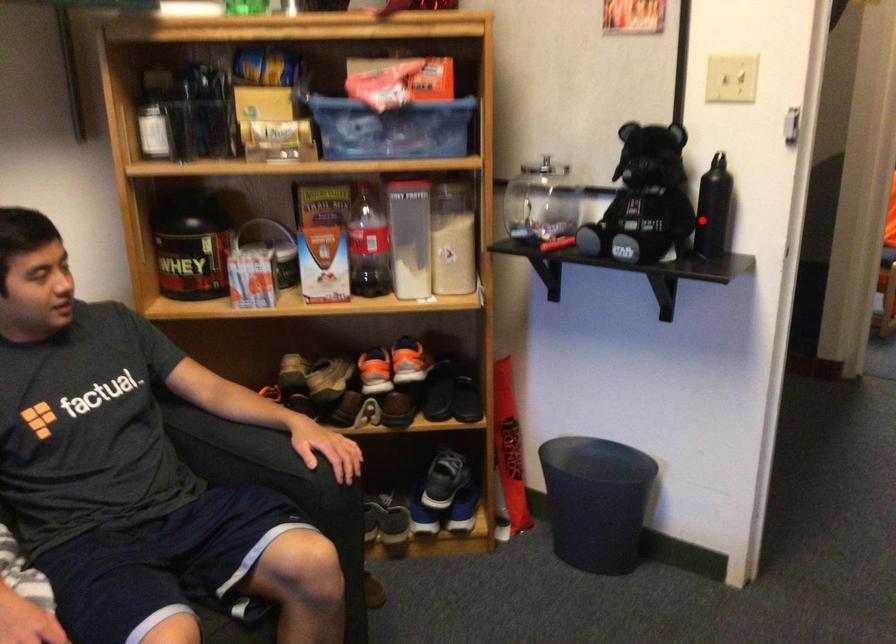
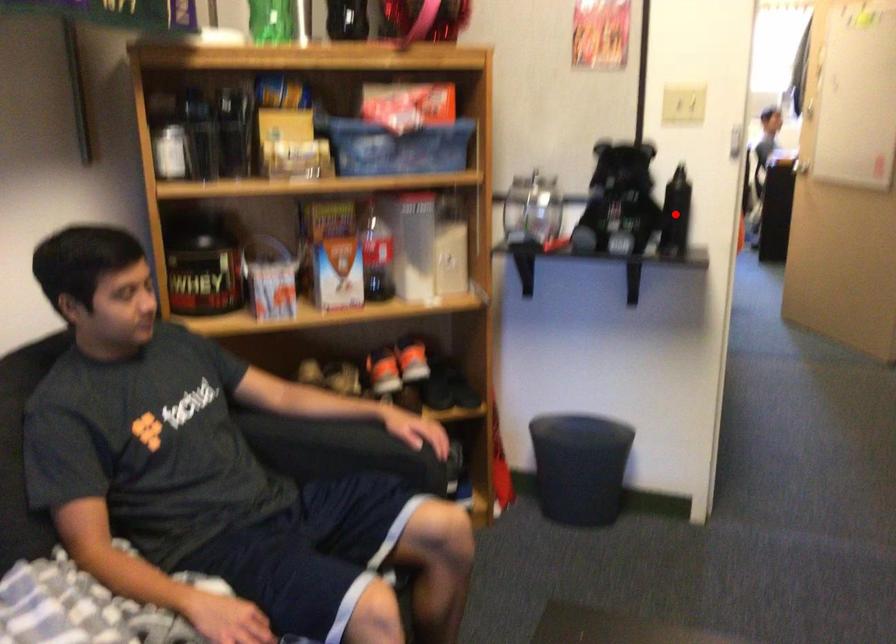
I am providing you with two images of the same scene from different viewpoints. A red point is marked on the first image and another point is marked on the second image. Does the point marked in image1 correspond to the same location as the one in image2?

Yes